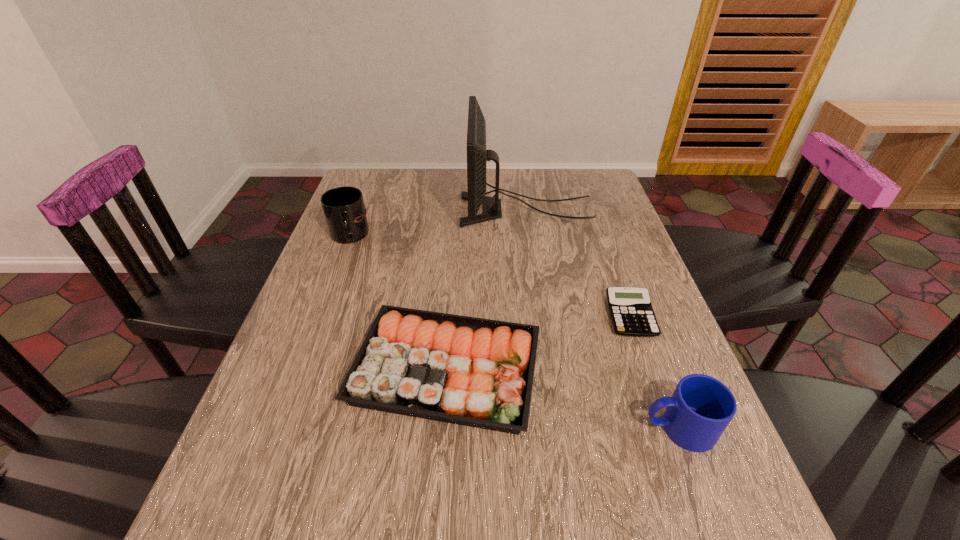
Where is `free location that satisfies the following two spatial constraints: 1. on the screen side of the tallest object; 2. with the handle on the side of the farther mug`? The image size is (960, 540). free location that satisfies the following two spatial constraints: 1. on the screen side of the tallest object; 2. with the handle on the side of the farther mug is located at coordinates (530, 237).